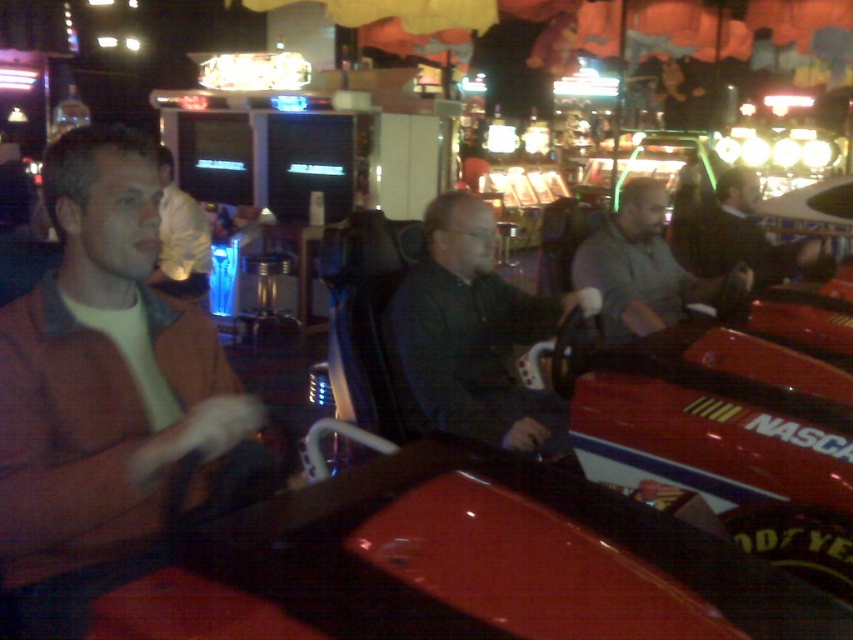
Question: Which of the following is the closest to the observer?

Choices:
 (A) dark gray shirt at center
 (B) white shirt at center

Answer: (A)

Question: Is matte brown jacket at left above dark gray sweater at center?

Choices:
 (A) no
 (B) yes

Answer: (A)

Question: Which object appears farthest from the camera in this image?

Choices:
 (A) gray matte shirt at center
 (B) dark gray shirt at center
 (C) matte brown jacket at left

Answer: (A)

Question: Which point appears closest to the camera in this image?

Choices:
 (A) (199, 284)
 (B) (735, 186)
 (C) (451, 376)
 (D) (198, 492)

Answer: (D)

Question: Considering the relative positions of matte brown jacket at left and dark gray sweater at center in the image provided, where is matte brown jacket at left located with respect to dark gray sweater at center?

Choices:
 (A) left
 (B) right

Answer: (A)

Question: Does matte brown jacket at left appear under dark gray sweater at center?

Choices:
 (A) no
 (B) yes

Answer: (B)